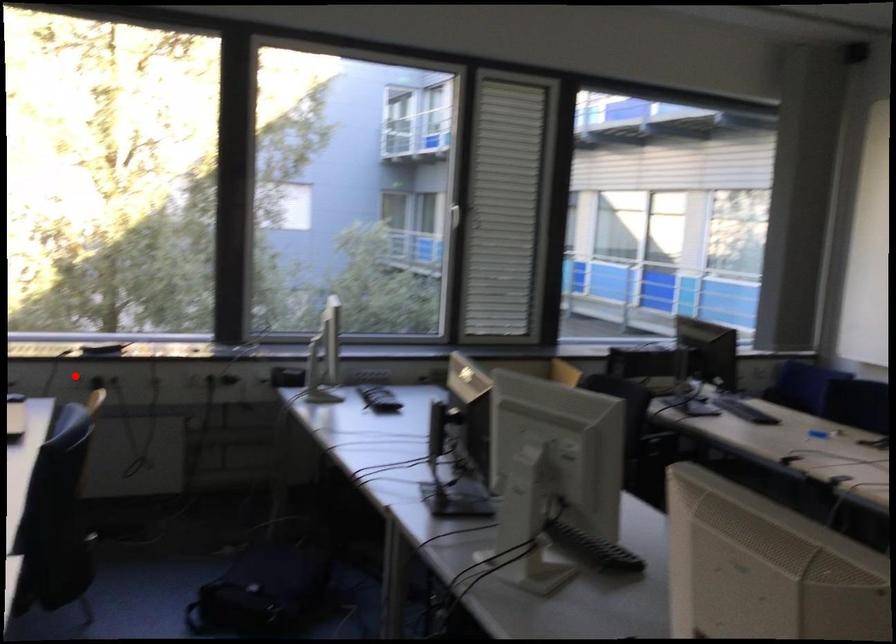
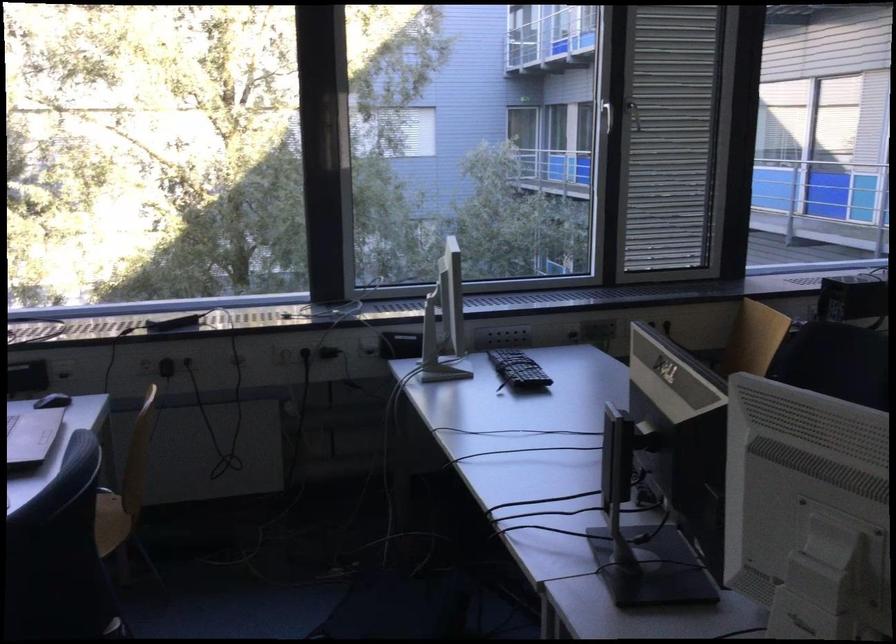
Question: I am providing you with two images of the same scene from different viewpoints. In image1, a red point is highlighted. Considering the same 3D point in image2, which of the following is correct?

Choices:
 (A) It is closer
 (B) It is farther

Answer: (A)